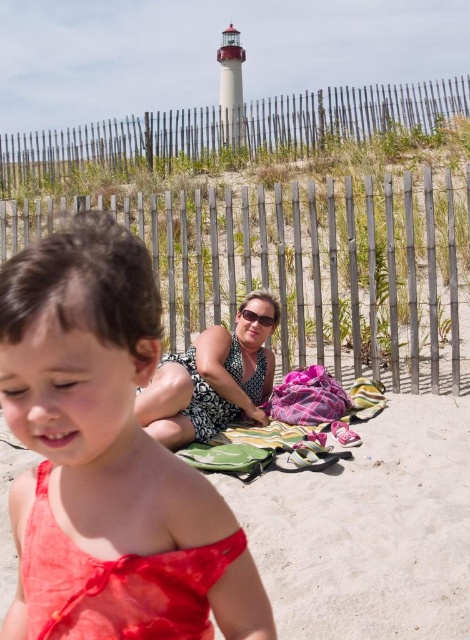
You are a photographer trying to capture a shot of the matte coral dress at center and the striped cotton blanket at center. Since you want both subjects in the frame, can you tell me which direction the dress is relative to the blanket?

The matte coral dress at center is positioned on the left side of the striped cotton blanket at center, so the dress is to the left of the blanket.

Looking at this image, you are a photographer trying to capture a photo of the matte coral dress at center and the matte black dress at center. Since you want to highlight the smaller one, which dress should you focus on?

The matte coral dress at center has a lesser width compared to the matte black dress at center, so you should focus on the matte coral dress at center to highlight the smaller one.

You are a photographer trying to capture a candid shot of the matte black dress at center without including the matte red bikini top at lower left in the frame. Is this possible based on their positions?

The matte red bikini top at lower left is in front of the matte black dress at center, so it would block the view. Therefore, you cannot capture the matte black dress at center without including the matte red bikini top at lower left in the frame.